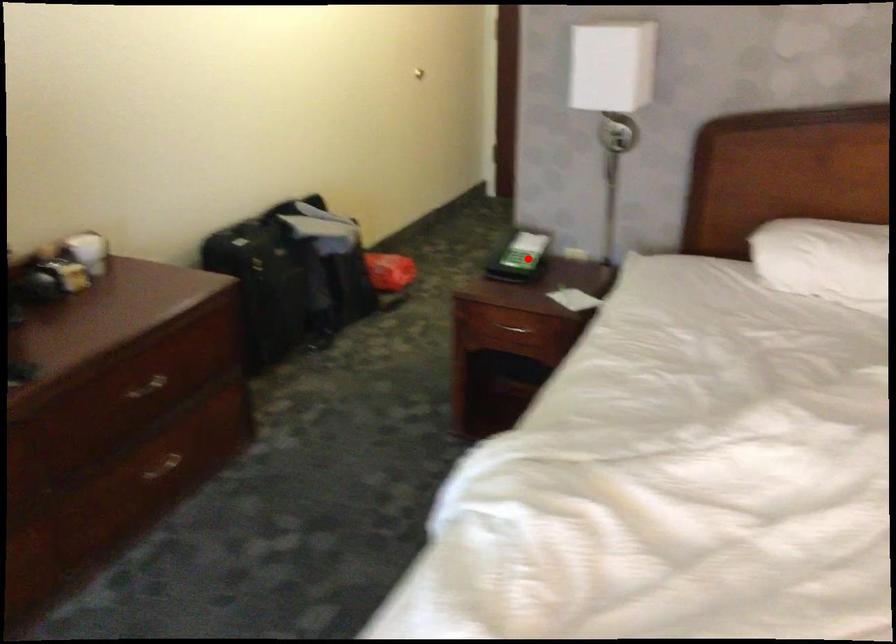
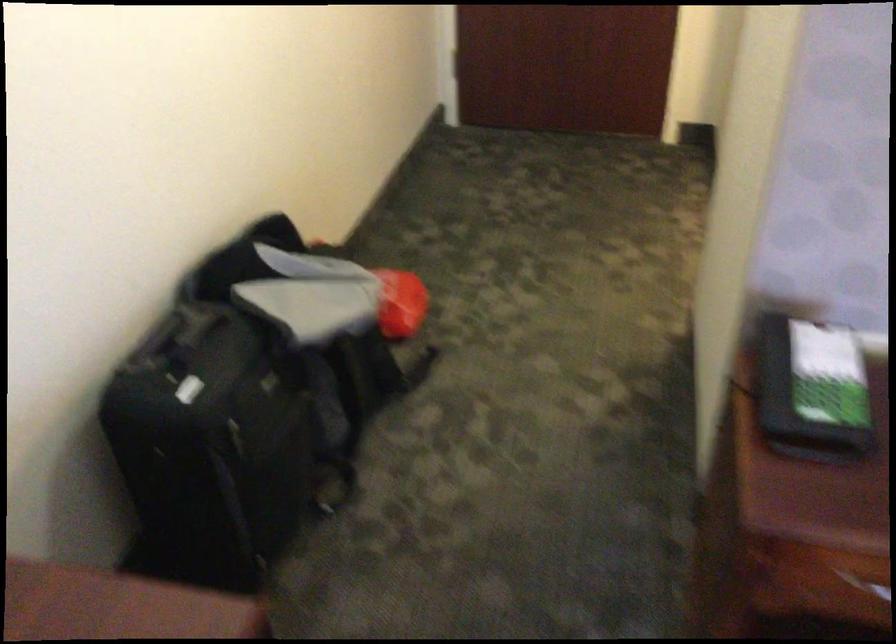
Question: A red point is marked in image1. In image2, is the corresponding 3D point closer to the camera or farther? Reply with the corresponding letter.

Choices:
 (A) The corresponding 3D point is closer.
 (B) The corresponding 3D point is farther.

Answer: (A)